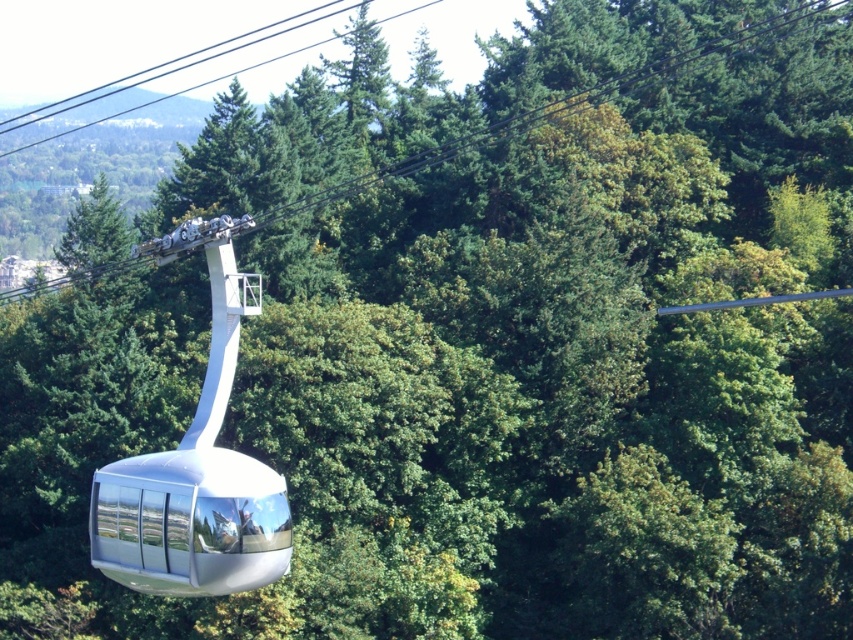
You are standing at the point with coordinates (x=614, y=90) in the image. What object is located at that point?

The black cable at upper center is located at point (x=614, y=90).

You are a maintenance worker inspecting the cable car system. You notice the black cable at upper center and the polished silver gondola at center. Which object has a greater size?

The black cable at upper center has a larger size compared to the polished silver gondola at center.

You are a maintenance worker inspecting the cable car system. You notice two lines at the upper center of the structure. Which one is wider between the black cable at upper center and the black wire at upper center?

The black cable at upper center is wider than the black wire at upper center.